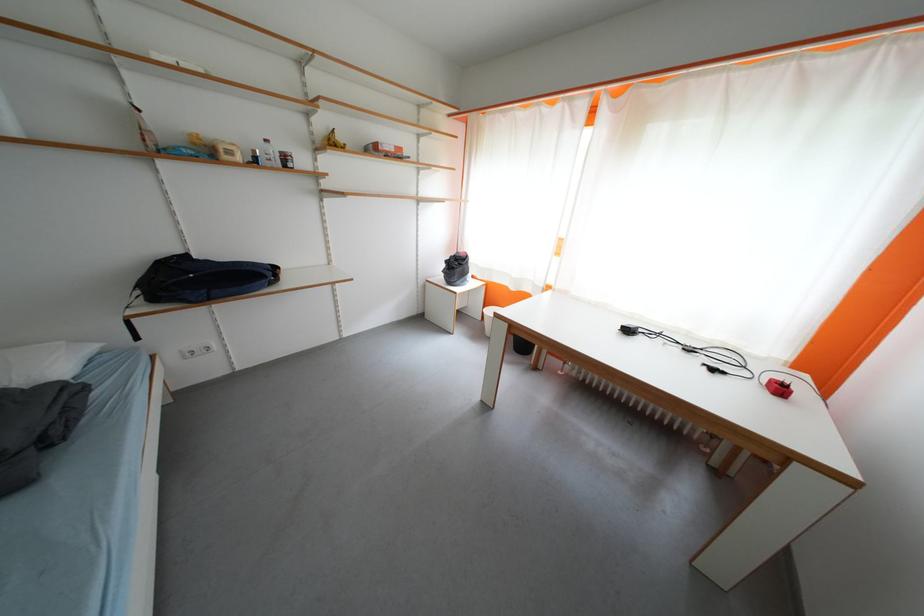
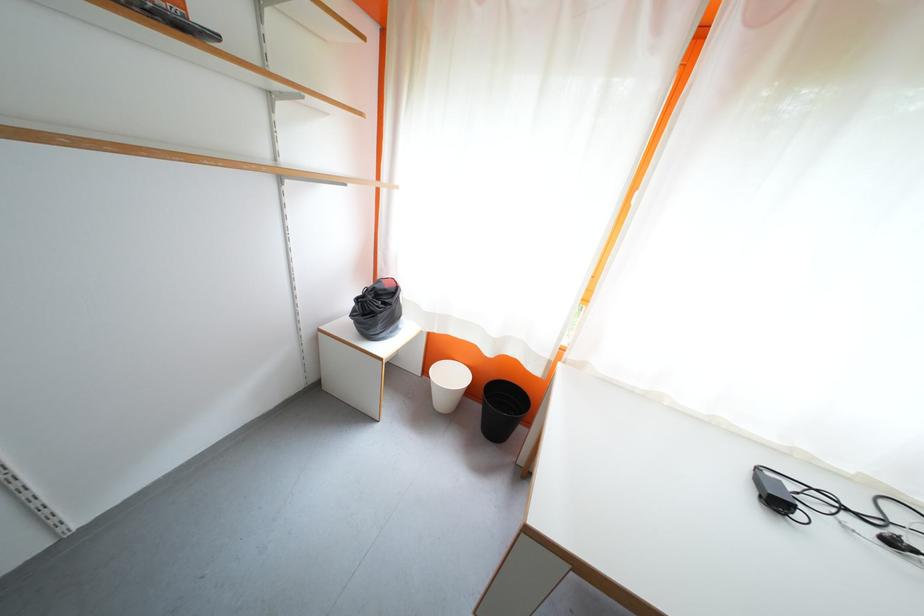
Question: The images are taken continuously from a first-person perspective. In which direction are you moving?

Choices:
 (A) Left
 (B) Right
 (C) Forward
 (D) Backward

Answer: (C)